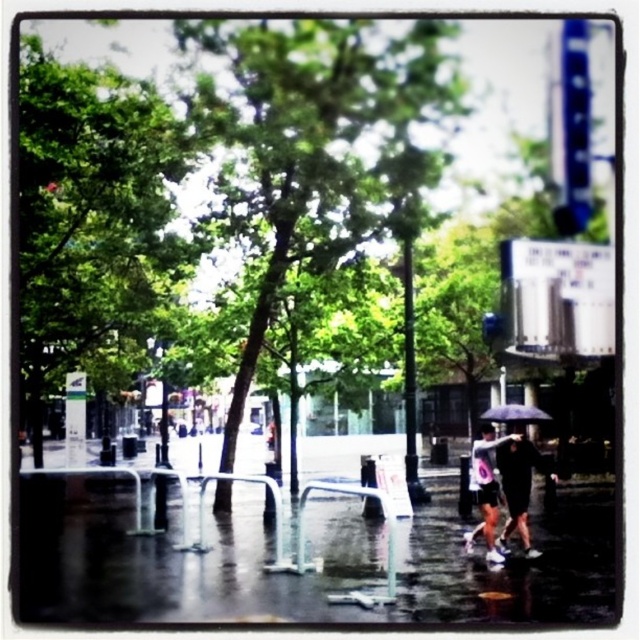
Which of these two, green leafy tree at center or dark gray fabric umbrella at lower right, stands taller?

green leafy tree at center is taller.

Who is positioned more to the left, green leafy tree at center or dark gray fabric umbrella at lower right?

Positioned to the left is green leafy tree at center.

Who is more forward, (x=305, y=186) or (x=512, y=444)?

Point (x=512, y=444) is more forward.

Identify the location of green leafy tree at center. (330, 144).

Does glossy concrete pavement at center have a larger size compared to green leafy tree at center?

Yes, glossy concrete pavement at center is bigger than green leafy tree at center.

The image size is (640, 640). Identify the location of glossy concrete pavement at center. (300, 556).

Between green leafy tree at center and white matte umbrella at lower right, which one has more height?

With more height is green leafy tree at center.

Is green leafy tree at center further to the viewer compared to white matte umbrella at lower right?

Yes, it is.

Does point (312, 186) lie behind point (493, 556)?

Yes, it is.

The image size is (640, 640). What are the coordinates of `green leafy tree at center` in the screenshot? It's located at (330, 144).